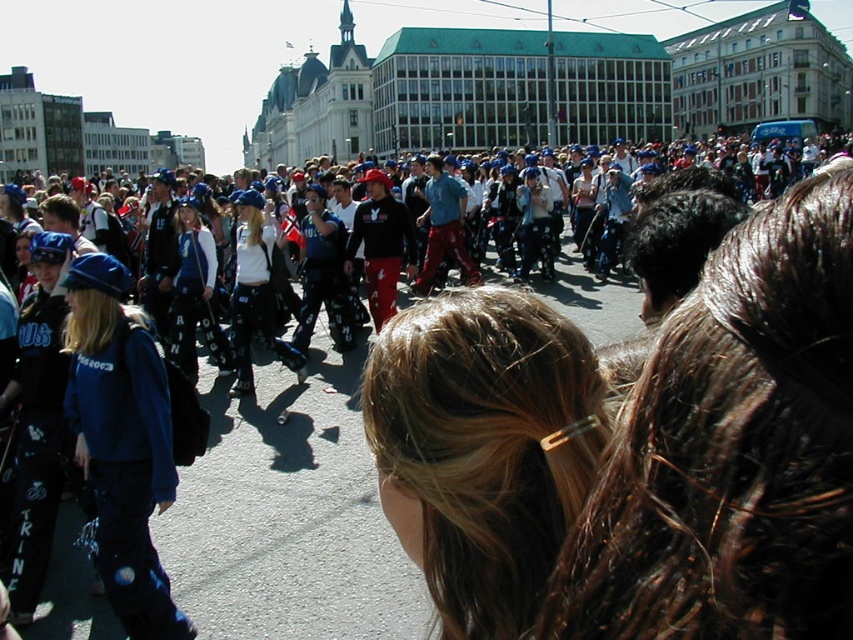
This screenshot has width=853, height=640. Describe the element at coordinates (120, 442) in the screenshot. I see `matte blue jacket at left` at that location.

Is point (115, 499) farther from camera compared to point (392, 252)?

No.

The width and height of the screenshot is (853, 640). Find the location of `matte blue jacket at left`. matte blue jacket at left is located at coordinates (120, 442).

Where is `matte blue jacket at left`? The image size is (853, 640). matte blue jacket at left is located at coordinates (120, 442).

Does brown hair at center have a lesser height compared to matte blue jacket at left?

Correct, brown hair at center is not as tall as matte blue jacket at left.

The height and width of the screenshot is (640, 853). Find the location of `brown hair at center`. brown hair at center is located at coordinates (483, 448).

Image resolution: width=853 pixels, height=640 pixels. In order to click on brown hair at center in this screenshot , I will do `click(483, 448)`.

Is matte blue jacket at left below black textured pants at center?

Yes.

Does matte blue jacket at left have a smaller size compared to black textured pants at center?

Incorrect, matte blue jacket at left is not smaller in size than black textured pants at center.

Between point (123, 561) and point (239, 352), which one is positioned behind?

The point (239, 352) is behind.

Image resolution: width=853 pixels, height=640 pixels. I want to click on matte blue jacket at left, so pos(120,442).